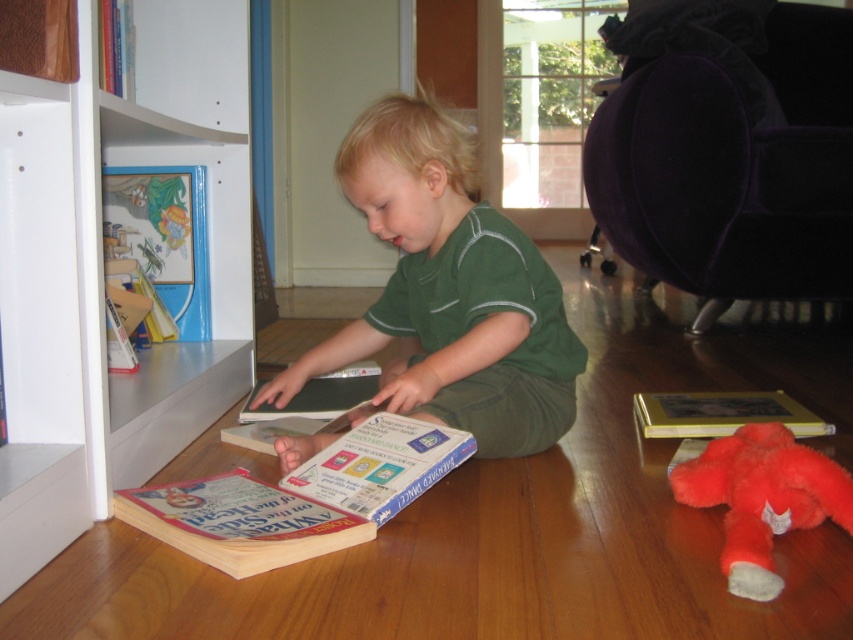
Which is above, green matte shirt at center or hardcover book at center?

green matte shirt at center is above.

Can you confirm if green matte shirt at center is smaller than hardcover book at center?

Actually, green matte shirt at center might be larger than hardcover book at center.

Find the location of a particular element. Image resolution: width=853 pixels, height=640 pixels. green matte shirt at center is located at coordinates (448, 292).

Does white matte bookshelf at lower left have a larger size compared to green matte shirt at center?

Correct, white matte bookshelf at lower left is larger in size than green matte shirt at center.

I want to click on white matte bookshelf at lower left, so click(x=103, y=272).

Does green matte shirt at center appear on the right side of fluffy red stuffed animal at lower right?

Incorrect, green matte shirt at center is not on the right side of fluffy red stuffed animal at lower right.

Between green matte shirt at center and fluffy red stuffed animal at lower right, which one appears on the right side from the viewer's perspective?

fluffy red stuffed animal at lower right is more to the right.

Identify the location of green matte shirt at center. (448, 292).